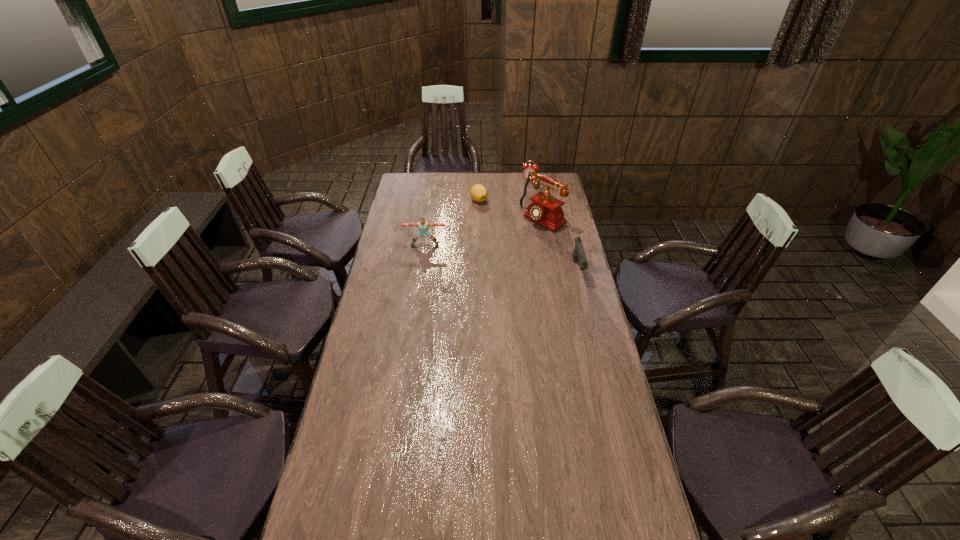
Where is `vacant point located at the stem end of the fourth nearest object`? The width and height of the screenshot is (960, 540). vacant point located at the stem end of the fourth nearest object is located at coordinates (480, 240).

This screenshot has height=540, width=960. Identify the location of free spot located at the stem end of the fourth nearest object. (481, 251).

Locate an element on the screen. The height and width of the screenshot is (540, 960). vacant space located at the stem end of the fourth nearest object is located at coordinates (479, 212).

The height and width of the screenshot is (540, 960). In order to click on vacant space positioned on the face of the farthest object in this screenshot , I will do `click(516, 210)`.

The image size is (960, 540). What are the coordinates of `vacant area located 0.190m on the face of the farthest object` in the screenshot? It's located at (520, 199).

I want to click on vacant area situated on the face of the farthest object, so click(514, 217).

Find the location of a particular element. vacant space located 0.310m on the dial of the third nearest object is located at coordinates (485, 258).

You are a GUI agent. You are given a task and a screenshot of the screen. Output one action in this format:
    pyautogui.click(x=<x>, y=<y>)
    Task: Click on the vacant space situated on the dial of the third nearest object
    The image size is (960, 540).
    Given the screenshot: What is the action you would take?
    pyautogui.click(x=504, y=245)

Find the location of a particular element. The height and width of the screenshot is (540, 960). vacant region located 0.190m on the dial of the third nearest object is located at coordinates (503, 246).

At what (x,y) coordinates should I click in order to perform the action: click on lemon located at the far edge. Please return your answer as a coordinate pair (x, y). The width and height of the screenshot is (960, 540). Looking at the image, I should click on (478, 192).